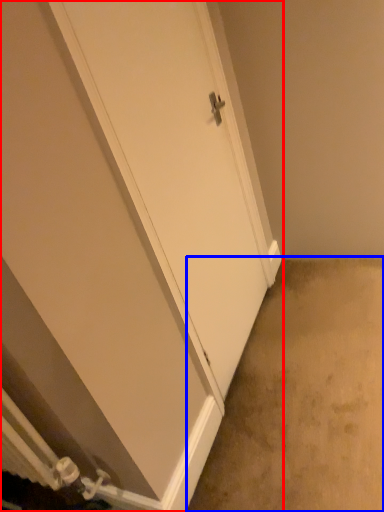
Question: Which object appears farthest to the camera in this image, door (highlighted by a red box) or concrete (highlighted by a blue box)?

Choices:
 (A) door
 (B) concrete

Answer: (B)